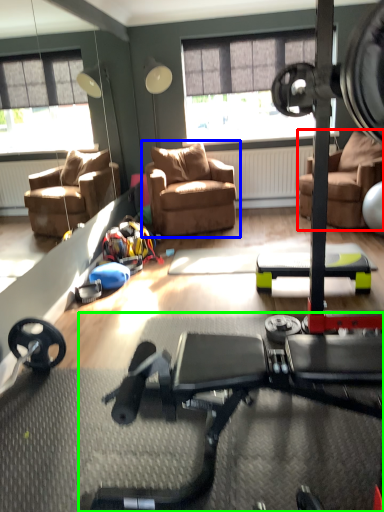
Question: Which object is positioned farthest from chair (highlighted by a red box)? Select from chair (highlighted by a blue box) and stationary bicycle (highlighted by a green box).

Choices:
 (A) chair
 (B) stationary bicycle

Answer: (B)